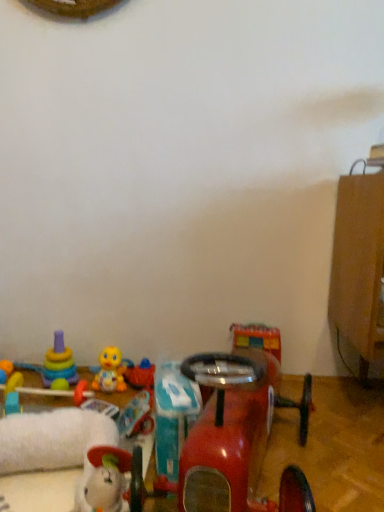
Question: Is yellow rubber duck at center, positioned as the 4th toy in right-to-left order, thinner than matte yellow toy at lower left, the seventh toy from the right?

Choices:
 (A) yes
 (B) no

Answer: (B)

Question: Does yellow rubber duck at center, placed as the fourth toy when sorted from left to right, contain matte yellow toy at lower left, the seventh toy from the right?

Choices:
 (A) no
 (B) yes

Answer: (A)

Question: Can you confirm if yellow rubber duck at center, positioned as the 4th toy in right-to-left order, is positioned to the left of matte yellow toy at lower left, which is the 1th toy from left to right?

Choices:
 (A) yes
 (B) no

Answer: (B)

Question: From the image's perspective, is yellow rubber duck at center, placed as the fourth toy when sorted from left to right, located beneath matte yellow toy at lower left, the seventh toy from the right?

Choices:
 (A) yes
 (B) no

Answer: (B)

Question: Can you confirm if yellow rubber duck at center, placed as the fourth toy when sorted from left to right, is positioned to the right of matte yellow toy at lower left, which is the 1th toy from left to right?

Choices:
 (A) no
 (B) yes

Answer: (B)

Question: From a real-world perspective, is yellow rubber duck at center, positioned as the 4th toy in right-to-left order, under matte yellow toy at lower left, which is the 1th toy from left to right?

Choices:
 (A) yes
 (B) no

Answer: (B)

Question: From the image's perspective, is stacked plastic rings at lower left, marked as the sixth toy in a right-to-left arrangement, located above teal plastic toy at center, the 6th toy from the left?

Choices:
 (A) yes
 (B) no

Answer: (A)

Question: Are stacked plastic rings at lower left, marked as the sixth toy in a right-to-left arrangement, and teal plastic toy at center, the 6th toy from the left, making contact?

Choices:
 (A) yes
 (B) no

Answer: (B)

Question: Can you confirm if stacked plastic rings at lower left, marked as the sixth toy in a right-to-left arrangement, is positioned to the right of teal plastic toy at center, marked as the 2th toy in a right-to-left arrangement?

Choices:
 (A) yes
 (B) no

Answer: (B)

Question: Is stacked plastic rings at lower left, placed as the 2th toy when sorted from left to right, facing towards teal plastic toy at center, marked as the 2th toy in a right-to-left arrangement?

Choices:
 (A) no
 (B) yes

Answer: (A)

Question: Is stacked plastic rings at lower left, marked as the sixth toy in a right-to-left arrangement, wider than teal plastic toy at center, marked as the 2th toy in a right-to-left arrangement?

Choices:
 (A) no
 (B) yes

Answer: (B)

Question: From a real-world perspective, is stacked plastic rings at lower left, placed as the 2th toy when sorted from left to right, positioned under teal plastic toy at center, the 6th toy from the left, based on gravity?

Choices:
 (A) yes
 (B) no

Answer: (B)

Question: Is matte yellow toy at lower left, which is the 1th toy from left to right, positioned before glossy plastic toy car at lower center, marked as the first toy in a right-to-left arrangement?

Choices:
 (A) no
 (B) yes

Answer: (A)